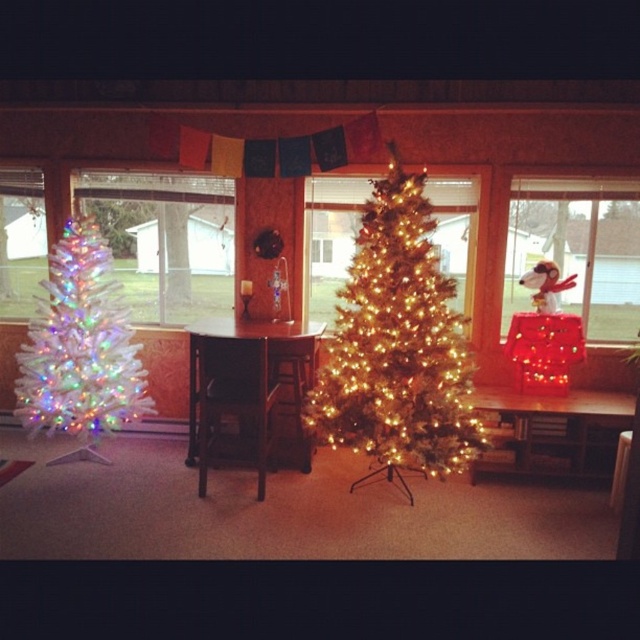
Question: Estimate the real-world distances between objects in this image. Which object is farther from the illuminated gold tree at center?

Choices:
 (A) white frosted glass window at left
 (B) iridescent gold christmas tree at center

Answer: (A)

Question: Does white frosted glass window at left appear under illuminated gold tree at center?

Choices:
 (A) no
 (B) yes

Answer: (A)

Question: Can you confirm if white frosted christmas tree at left is thinner than illuminated gold tree at center?

Choices:
 (A) yes
 (B) no

Answer: (B)

Question: Estimate the real-world distances between objects in this image. Which object is farther from the red fabric snoopy at right?

Choices:
 (A) iridescent gold christmas tree at center
 (B) white frosted christmas tree at left
 (C) illuminated gold tree at center

Answer: (B)

Question: Among these points, which one is nearest to the camera?

Choices:
 (A) (100, 237)
 (B) (333, 262)

Answer: (A)

Question: Is iridescent gold christmas tree at center closer to camera compared to white frosted christmas tree at left?

Choices:
 (A) no
 (B) yes

Answer: (B)